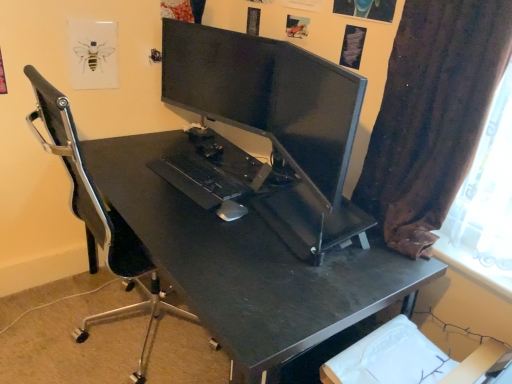
Question: Is black matte desk at center far from brown fabric curtain at right?

Choices:
 (A) yes
 (B) no

Answer: (B)

Question: Is black matte desk at center smaller than brown fabric curtain at right?

Choices:
 (A) yes
 (B) no

Answer: (B)

Question: Considering the relative sizes of black matte desk at center and brown fabric curtain at right in the image provided, is black matte desk at center wider than brown fabric curtain at right?

Choices:
 (A) yes
 (B) no

Answer: (A)

Question: Does black matte desk at center appear on the right side of brown fabric curtain at right?

Choices:
 (A) no
 (B) yes

Answer: (A)

Question: Is brown fabric curtain at right surrounded by black matte desk at center?

Choices:
 (A) no
 (B) yes

Answer: (A)

Question: Is black matte desk at center next to brown fabric curtain at right?

Choices:
 (A) yes
 (B) no

Answer: (B)

Question: Does white matte mouse at center have a greater height compared to brown fabric curtain at right?

Choices:
 (A) yes
 (B) no

Answer: (B)

Question: From the image's perspective, is white matte mouse at center above brown fabric curtain at right?

Choices:
 (A) yes
 (B) no

Answer: (B)

Question: Is white matte mouse at center shorter than brown fabric curtain at right?

Choices:
 (A) no
 (B) yes

Answer: (B)

Question: Is white matte mouse at center to the left of brown fabric curtain at right from the viewer's perspective?

Choices:
 (A) no
 (B) yes

Answer: (B)

Question: Would you consider white matte mouse at center to be distant from brown fabric curtain at right?

Choices:
 (A) yes
 (B) no

Answer: (B)

Question: Is white matte mouse at center touching brown fabric curtain at right?

Choices:
 (A) no
 (B) yes

Answer: (A)

Question: Is black matte desk at center behind white matte mouse at center?

Choices:
 (A) yes
 (B) no

Answer: (B)